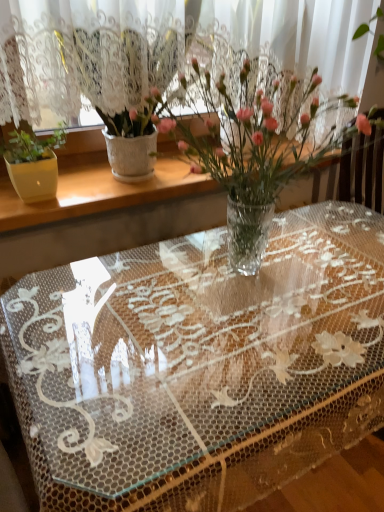
The width and height of the screenshot is (384, 512). What do you see at coordinates (196, 358) in the screenshot?
I see `transparent lace tablecloth at center` at bounding box center [196, 358].

Where is `transparent lace tablecloth at center`? transparent lace tablecloth at center is located at coordinates (196, 358).

Is white textured vase at upper left far away from white textured pot at left, which ranks as the 2th houseplant in right-to-left order?

Answer: They are positioned close to each other.

Is point (106, 195) positioned in front of point (76, 59)?

No, it is not.

Is white textured vase at upper left located outside white textured pot at left, positioned as the first houseplant in left-to-right order?

Yes.

From the image's perspective, which is below, white textured vase at upper left or white textured pot at left, positioned as the first houseplant in left-to-right order?

white textured vase at upper left appears lower in the image.

Is clear plastic vase at center, the 2th houseplant viewed from the left, touching white textured vase at upper left?

They are not placed beside each other.

Between clear plastic vase at center, positioned as the first houseplant in right-to-left order, and white textured vase at upper left, which one appears on the right side from the viewer's perspective?

From the viewer's perspective, clear plastic vase at center, positioned as the first houseplant in right-to-left order, appears more on the right side.

From a real-world perspective, is clear plastic vase at center, positioned as the first houseplant in right-to-left order, beneath white textured vase at upper left?

No, from a real-world perspective, clear plastic vase at center, positioned as the first houseplant in right-to-left order, is not beneath white textured vase at upper left.

Considering the relative positions of clear plastic vase at center, the 2th houseplant viewed from the left, and white textured vase at upper left in the image provided, is clear plastic vase at center, the 2th houseplant viewed from the left, behind white textured vase at upper left?

No, clear plastic vase at center, the 2th houseplant viewed from the left, is closer to the viewer.

Which object is thinner, clear plastic vase at center, the 2th houseplant viewed from the left, or white textured pot at left, positioned as the first houseplant in left-to-right order?

white textured pot at left, positioned as the first houseplant in left-to-right order.

Is clear plastic vase at center, the 2th houseplant viewed from the left, next to white textured pot at left, positioned as the first houseplant in left-to-right order?

No, clear plastic vase at center, the 2th houseplant viewed from the left, is not beside white textured pot at left, positioned as the first houseplant in left-to-right order.

At what (x,y) coordinates should I click in order to perform the action: click on houseplant that appears above the clear plastic vase at center, positioned as the first houseplant in right-to-left order (from the image's perspective). Please return your answer as a coordinate pair (x, y). This screenshot has width=384, height=512. Looking at the image, I should click on (127, 70).

Is white textured vase at upper left to the right of transparent lace tablecloth at center from the viewer's perspective?

Incorrect, white textured vase at upper left is not on the right side of transparent lace tablecloth at center.

Is white textured vase at upper left looking in the opposite direction of transparent lace tablecloth at center?

No, white textured vase at upper left is not facing the opposite direction of transparent lace tablecloth at center.

From the picture: Is white textured vase at upper left not near transparent lace tablecloth at center?

No, there isn't a large distance between white textured vase at upper left and transparent lace tablecloth at center.

Is clear plastic vase at center, the 2th houseplant viewed from the left, spatially inside transparent lace tablecloth at center, or outside of it?

The correct answer is: outside.

From a real-world perspective, relative to transparent lace tablecloth at center, is clear plastic vase at center, positioned as the first houseplant in right-to-left order, vertically above or below?

clear plastic vase at center, positioned as the first houseplant in right-to-left order, is situated higher than transparent lace tablecloth at center in the real world.

Does clear plastic vase at center, the 2th houseplant viewed from the left, lie in front of transparent lace tablecloth at center?

No, clear plastic vase at center, the 2th houseplant viewed from the left, is behind transparent lace tablecloth at center.

How many degrees apart are the facing directions of clear plastic vase at center, positioned as the first houseplant in right-to-left order, and transparent lace tablecloth at center?

The angle between the facing direction of clear plastic vase at center, positioned as the first houseplant in right-to-left order, and the facing direction of transparent lace tablecloth at center is 0.839 degrees.

Does transparent lace tablecloth at center have a greater height compared to white textured vase at upper left?

Indeed, transparent lace tablecloth at center has a greater height compared to white textured vase at upper left.

Between transparent lace tablecloth at center and white textured vase at upper left, which one appears on the right side from the viewer's perspective?

transparent lace tablecloth at center is more to the right.

Which is in front, transparent lace tablecloth at center or white textured vase at upper left?

Positioned in front is transparent lace tablecloth at center.

Considering the points (223, 489) and (102, 157), which point is in front, point (223, 489) or point (102, 157)?

The point (223, 489) is closer to the camera.

Find the location of a particular element. This screenshot has width=384, height=512. houseplant located behind the clear plastic vase at center, the 2th houseplant viewed from the left is located at coordinates (127, 70).

Does white textured pot at left, positioned as the first houseplant in left-to-right order, appear on the left side of clear plastic vase at center, the 2th houseplant viewed from the left?

Correct, you'll find white textured pot at left, positioned as the first houseplant in left-to-right order, to the left of clear plastic vase at center, the 2th houseplant viewed from the left.

Is white textured pot at left, positioned as the first houseplant in left-to-right order, turned away from clear plastic vase at center, positioned as the first houseplant in right-to-left order?

white textured pot at left, positioned as the first houseplant in left-to-right order, does not have its back to clear plastic vase at center, positioned as the first houseplant in right-to-left order.

Are white textured pot at left, positioned as the first houseplant in left-to-right order, and clear plastic vase at center, positioned as the first houseplant in right-to-left order, beside each other?

There is a gap between white textured pot at left, positioned as the first houseplant in left-to-right order, and clear plastic vase at center, positioned as the first houseplant in right-to-left order.

I want to click on window sill below the white textured pot at left, which ranks as the 2th houseplant in right-to-left order (from the image's perspective), so click(97, 191).

Identify the location of window sill to the left of clear plastic vase at center, the 2th houseplant viewed from the left. The width and height of the screenshot is (384, 512). (97, 191).

Which object lies further to the anchor point white textured pot at left, positioned as the first houseplant in left-to-right order, transparent lace tablecloth at center or clear plastic vase at center, positioned as the first houseplant in right-to-left order?

Among the two, transparent lace tablecloth at center is located further to white textured pot at left, positioned as the first houseplant in left-to-right order.

Which object lies nearer to the anchor point white textured pot at left, which ranks as the 2th houseplant in right-to-left order, clear plastic vase at center, positioned as the first houseplant in right-to-left order, or white textured vase at upper left?

The object closer to white textured pot at left, which ranks as the 2th houseplant in right-to-left order, is clear plastic vase at center, positioned as the first houseplant in right-to-left order.

Estimate the real-world distances between objects in this image. Which object is further from clear plastic vase at center, positioned as the first houseplant in right-to-left order, transparent lace tablecloth at center or white textured vase at upper left?

The object further to clear plastic vase at center, positioned as the first houseplant in right-to-left order, is transparent lace tablecloth at center.

Considering their positions, is white textured vase at upper left positioned further to white textured pot at left, positioned as the first houseplant in left-to-right order, than clear plastic vase at center, positioned as the first houseplant in right-to-left order?

white textured vase at upper left lies further to white textured pot at left, positioned as the first houseplant in left-to-right order, than the other object.

Looking at the image, which one is located closer to clear plastic vase at center, positioned as the first houseplant in right-to-left order, white textured vase at upper left or white textured pot at left, which ranks as the 2th houseplant in right-to-left order?

white textured pot at left, which ranks as the 2th houseplant in right-to-left order.

When comparing their distances from white textured vase at upper left, does white textured pot at left, positioned as the first houseplant in left-to-right order, or clear plastic vase at center, the 2th houseplant viewed from the left, seem further?

Among the two, clear plastic vase at center, the 2th houseplant viewed from the left, is located further to white textured vase at upper left.

Considering their positions, is white textured pot at left, positioned as the first houseplant in left-to-right order, positioned further to transparent lace tablecloth at center than white textured vase at upper left?

The object further to transparent lace tablecloth at center is white textured pot at left, positioned as the first houseplant in left-to-right order.

Looking at the image, which one is located closer to transparent lace tablecloth at center, white textured pot at left, positioned as the first houseplant in left-to-right order, or clear plastic vase at center, positioned as the first houseplant in right-to-left order?

clear plastic vase at center, positioned as the first houseplant in right-to-left order, lies closer to transparent lace tablecloth at center than the other object.

In order to click on houseplant located between clear plastic vase at center, positioned as the first houseplant in right-to-left order, and white textured vase at upper left in the depth direction in this screenshot , I will do `click(127, 70)`.

The image size is (384, 512). I want to click on houseplant between white textured pot at left, which ranks as the 2th houseplant in right-to-left order, and transparent lace tablecloth at center vertically, so click(x=252, y=150).

Where is `window sill between white textured pot at left, positioned as the first houseplant in left-to-right order, and transparent lace tablecloth at center vertically`? This screenshot has height=512, width=384. window sill between white textured pot at left, positioned as the first houseplant in left-to-right order, and transparent lace tablecloth at center vertically is located at coordinates (97, 191).

Find the location of a particular element. This screenshot has height=512, width=384. houseplant that lies between white textured vase at upper left and transparent lace tablecloth at center from top to bottom is located at coordinates (252, 150).